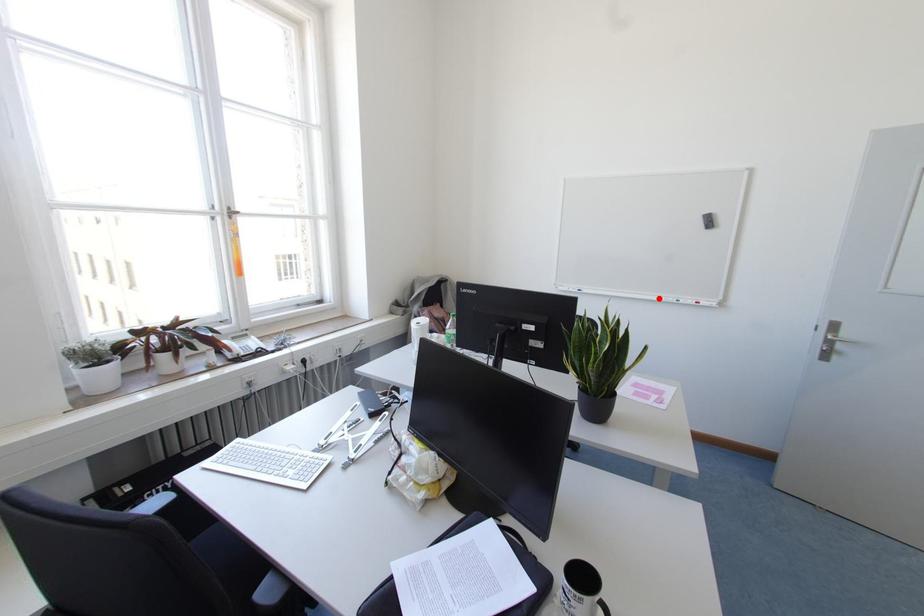
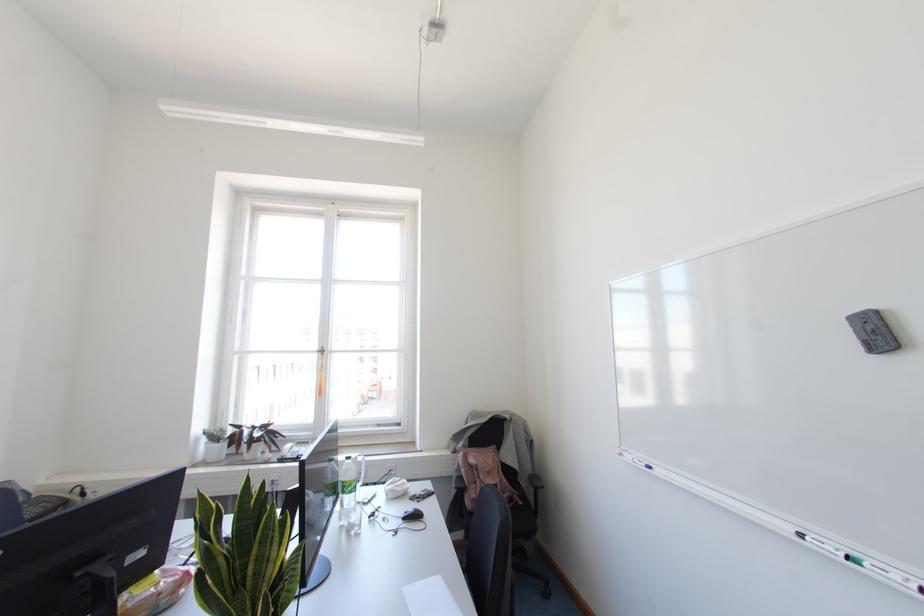
Where in the second image is the point corresponding to the highlighted location from the first image?

(800, 536)